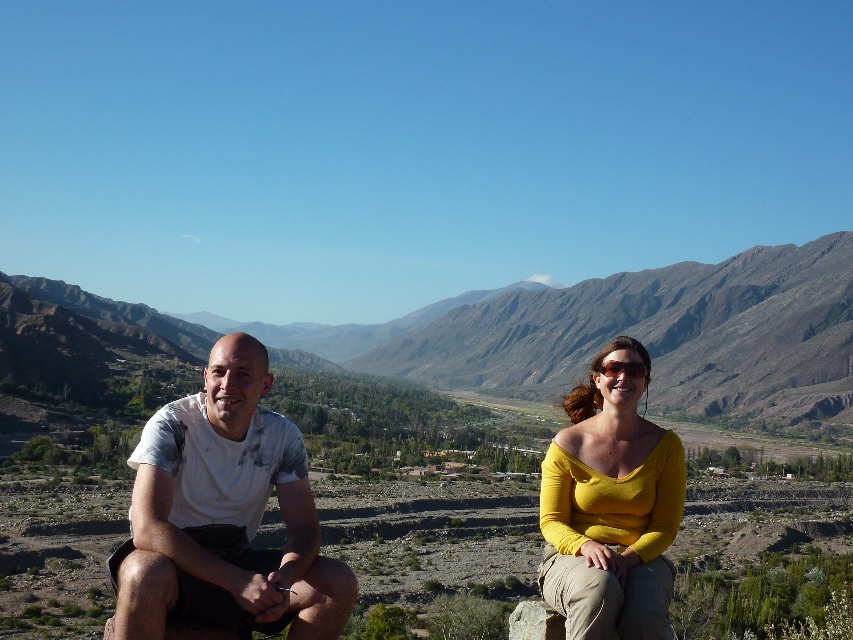
Question: Does white cotton t-shirt at left appear under matte yellow top at center?

Choices:
 (A) no
 (B) yes

Answer: (B)

Question: In this image, where is brown rocky mountain at center located relative to white cotton shirt at center?

Choices:
 (A) left
 (B) right

Answer: (A)

Question: Among these objects, which one is nearest to the camera?

Choices:
 (A) white cotton t-shirt at left
 (B) matte yellow top at center
 (C) brown rocky mountain at center

Answer: (A)

Question: Is white cotton t-shirt at left further to the viewer compared to matte yellow top at center?

Choices:
 (A) yes
 (B) no

Answer: (B)

Question: Which of these objects is positioned farthest from the sunglasses at center?

Choices:
 (A) matte yellow top at center
 (B) brown rocky mountain at center
 (C) white cotton shirt at center

Answer: (B)

Question: Which object is positioned closest to the white cotton t-shirt at left?

Choices:
 (A) sunglasses at center
 (B) matte yellow top at center

Answer: (B)